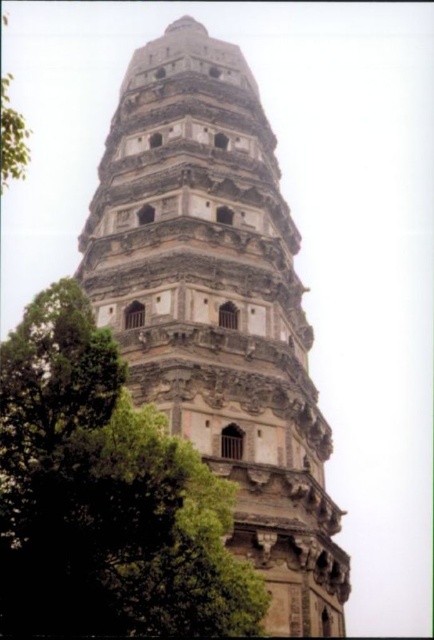
From the picture: You are an architect analyzing the spatial relationship between the stone tower at center and the green leafy tree at center in the image. Based on their widths, which one occupies more horizontal space in the scene?

The stone tower at center is wider than the green leafy tree at center, so it occupies more horizontal space in the scene.

You are a park ranger who needs to assess if a new walking path can be safely placed between the stone tower at center and the green leafy tree at center. The path requires a minimum of 50 feet of space between them to ensure safety. Can the path be constructed?

The distance between the stone tower at center and the green leafy tree at center is 56.26 feet, which exceeds the required 50 feet. Therefore, the path can be safely constructed between them.